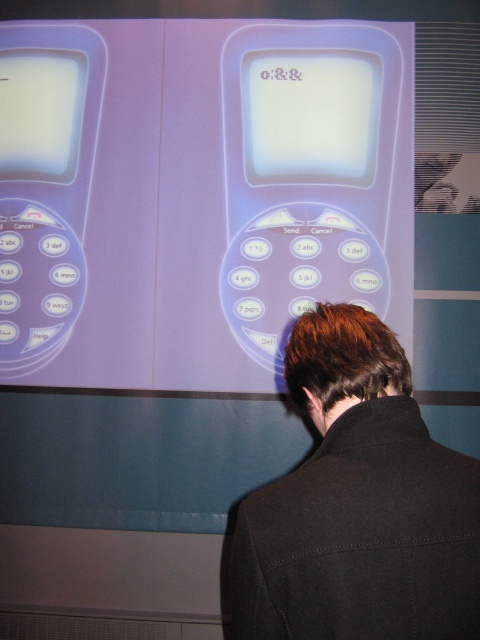
You are a GUI agent. You are given a task and a screenshot of the screen. Output one action in this format:
    pyautogui.click(x=<x>, y=<y>)
    Task: Click on the matte plastic button at center
    This screenshot has height=640, width=480.
    Given the screenshot: What is the action you would take?
    pyautogui.click(x=249, y=308)

Does point (233, 305) come in front of point (230, 280)?

Yes, it is.

Locate an element on the screen. The height and width of the screenshot is (640, 480). matte plastic button at center is located at coordinates (249, 308).

In order to click on matte plastic button at center in this screenshot , I will do `click(249, 308)`.

Can you confirm if black fabric at center is bigger than white glossy screen at upper left?

Yes.

Can you confirm if black fabric at center is positioned below white glossy screen at upper left?

Yes, black fabric at center is below white glossy screen at upper left.

This screenshot has height=640, width=480. Describe the element at coordinates (359, 502) in the screenshot. I see `black fabric at center` at that location.

At what (x,y) coordinates should I click in order to perform the action: click on black fabric at center. Please return your answer as a coordinate pair (x, y). Looking at the image, I should click on (359, 502).

Can you confirm if white glossy screen at upper left is wider than matte white button at center?

Indeed, white glossy screen at upper left has a greater width compared to matte white button at center.

Is white glossy screen at upper left above matte white button at center?

Yes.

Does point (15, 122) lie in front of point (245, 276)?

No, it is behind (245, 276).

This screenshot has height=640, width=480. In order to click on white glossy screen at upper left in this screenshot , I will do `click(40, 113)`.